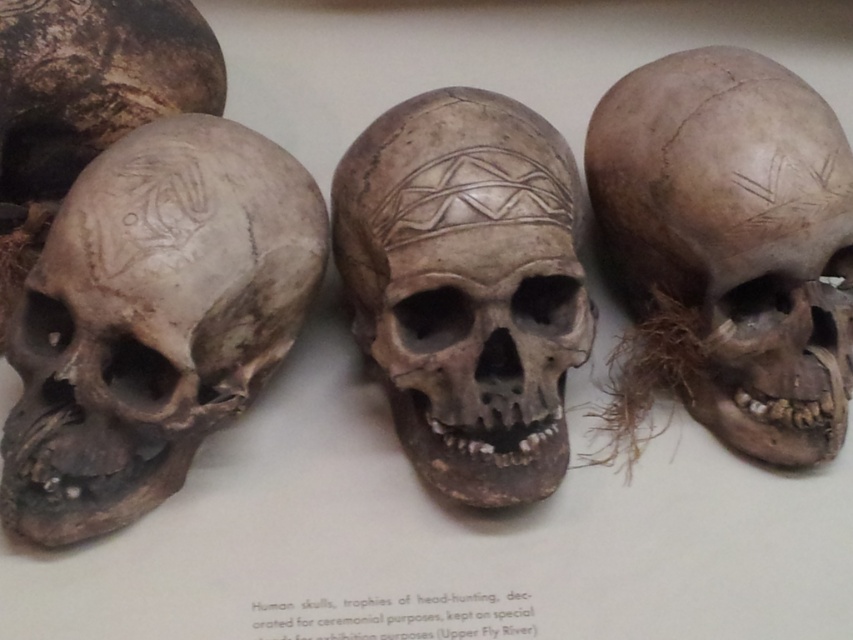
You are an anthropologist examining the skulls displayed in the image. You need to determine which of the two skulls, the gray matte skull at left or the brown textured skull at right, is taller. Based on the scene description, which one is taller?

The brown textured skull at right is taller than the gray matte skull at left.

You are an anthropologist examining the skulls displayed in the image. You need to determine which of the two skulls, the gray matte skull at left or the brown textured skull at center, is bigger in size. Based on the scene, which one is larger?

The gray matte skull at left has a larger size compared to the brown textured skull at center, so the gray matte skull at left is bigger.